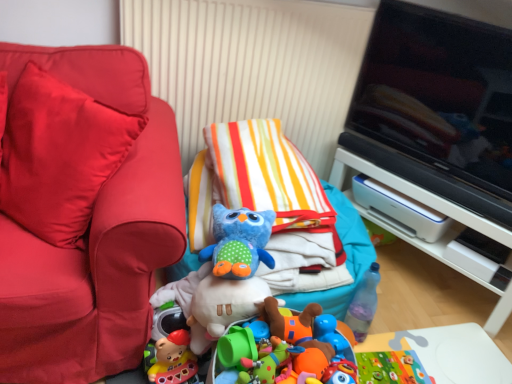
Question: From a real-world perspective, is matte red couch at left, the 2th furniture positioned from the back, physically below blue plush owl at center, the first toy positioned from the top?

Choices:
 (A) yes
 (B) no

Answer: (B)

Question: Does matte red couch at left, marked as the first furniture in a front-to-back arrangement, come in front of blue plush owl at center, the first toy positioned from the top?

Choices:
 (A) yes
 (B) no

Answer: (A)

Question: Would you say matte red couch at left, the 2th furniture positioned from the back, is outside blue plush owl at center, the first toy positioned from the top?

Choices:
 (A) yes
 (B) no

Answer: (A)

Question: Considering the relative sizes of matte red couch at left, the 2th furniture positioned from the back, and blue plush owl at center, the 2th toy positioned from the bottom, in the image provided, is matte red couch at left, the 2th furniture positioned from the back, bigger than blue plush owl at center, the 2th toy positioned from the bottom,?

Choices:
 (A) yes
 (B) no

Answer: (A)

Question: Is matte red couch at left, the 2th furniture positioned from the back, looking in the opposite direction of blue plush owl at center, which is the second toy from right to left?

Choices:
 (A) no
 (B) yes

Answer: (A)

Question: Is matte red couch at left, the 2th furniture positioned from the back, facing towards blue plush owl at center, which is the second toy from right to left?

Choices:
 (A) yes
 (B) no

Answer: (B)

Question: Is white plastic printer at right, placed as the 1th furniture when sorted from back to front, directly adjacent to blue rubber duck at center, placed as the 1th toy when sorted from back to front?

Choices:
 (A) yes
 (B) no

Answer: (B)

Question: Does white plastic printer at right, the second furniture positioned from the left, have a lesser height compared to blue rubber duck at center, placed as the 2th toy when sorted from left to right?

Choices:
 (A) no
 (B) yes

Answer: (A)

Question: Does white plastic printer at right, placed as the 1th furniture when sorted from back to front, appear on the right side of blue rubber duck at center, placed as the 2th toy when sorted from left to right?

Choices:
 (A) yes
 (B) no

Answer: (A)

Question: Is blue rubber duck at center, placed as the 1th toy when sorted from back to front, surrounded by white plastic printer at right, the 1th furniture viewed from the right?

Choices:
 (A) yes
 (B) no

Answer: (B)

Question: Does white plastic printer at right, placed as the 1th furniture when sorted from back to front, appear on the left side of blue rubber duck at center, acting as the first toy starting from the right?

Choices:
 (A) no
 (B) yes

Answer: (A)

Question: Would you say white plastic printer at right, positioned as the 2th furniture in front-to-back order, is outside blue rubber duck at center, the 2th toy in the front-to-back sequence?

Choices:
 (A) no
 (B) yes

Answer: (B)

Question: Is black glossy television at upper right outside matte red couch at left, placed as the second furniture when sorted from right to left?

Choices:
 (A) no
 (B) yes

Answer: (B)